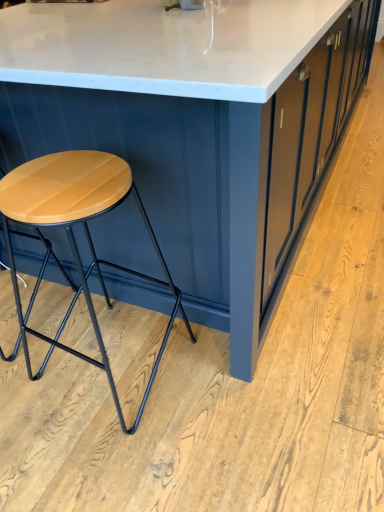
Question: Considering the positions of point (23, 174) and point (92, 33), is point (23, 174) closer or farther from the camera than point (92, 33)?

Choices:
 (A) closer
 (B) farther

Answer: (A)

Question: Based on their positions, is wooden matte stool at left located to the left or right of white marble table at center?

Choices:
 (A) right
 (B) left

Answer: (B)

Question: Looking at their shapes, would you say wooden matte stool at left is wider or thinner than white marble table at center?

Choices:
 (A) wide
 (B) thin

Answer: (B)

Question: Which is correct: white marble table at center is inside wooden matte stool at left, or outside of it?

Choices:
 (A) outside
 (B) inside

Answer: (A)

Question: Based on their sizes in the image, would you say white marble table at center is bigger or smaller than wooden matte stool at left?

Choices:
 (A) small
 (B) big

Answer: (B)

Question: In the image, is white marble table at center positioned in front of or behind wooden matte stool at left?

Choices:
 (A) front
 (B) behind

Answer: (A)

Question: In the image, is white marble table at center on the left side or the right side of wooden matte stool at left?

Choices:
 (A) left
 (B) right

Answer: (B)